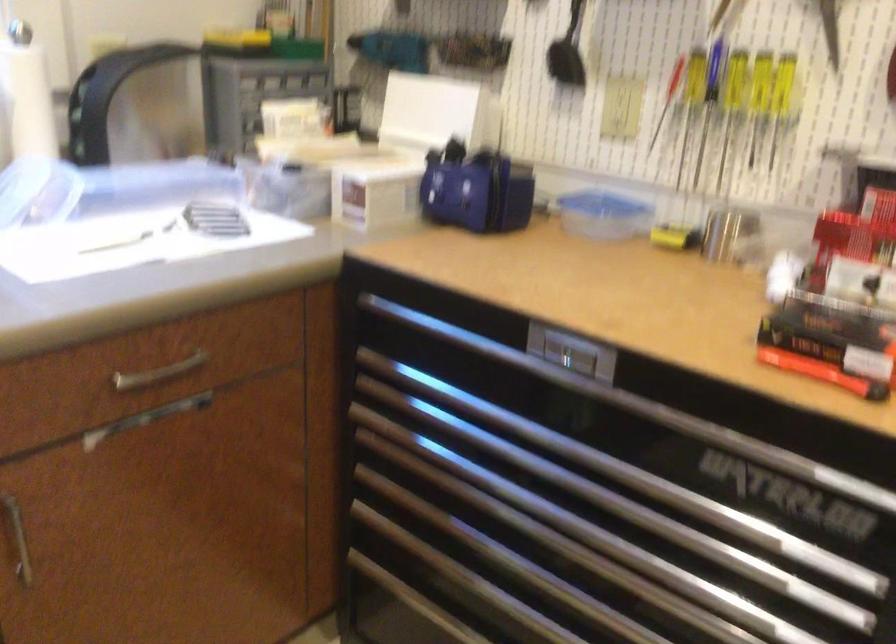
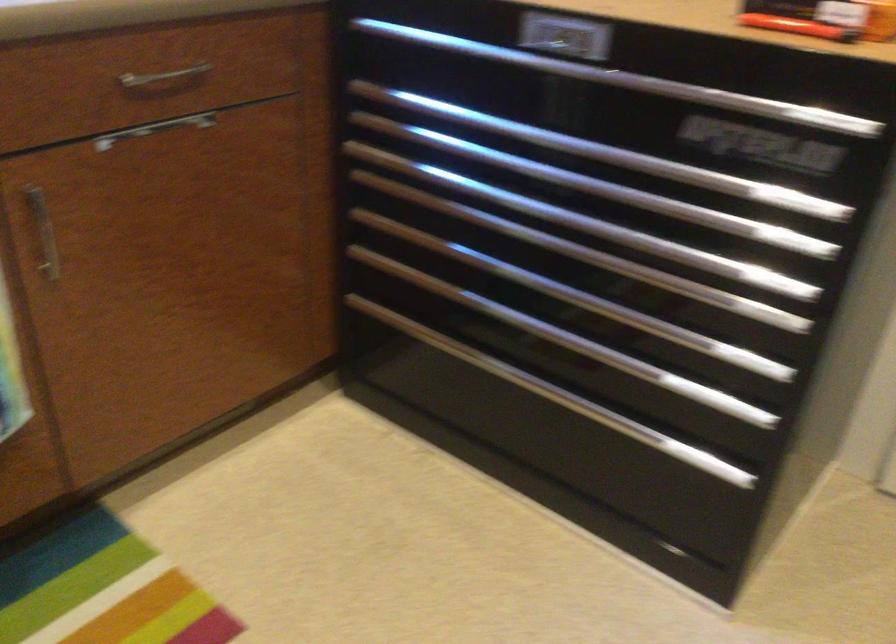
Question: How did the camera likely rotate?

Choices:
 (A) Left
 (B) Right
 (C) Up
 (D) Down

Answer: (D)